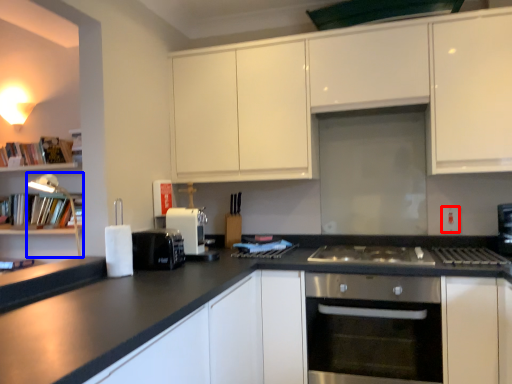
Question: Which object appears farthest to the camera in this image, electric outlet (highlighted by a red box) or lamp (highlighted by a blue box)?

Choices:
 (A) electric outlet
 (B) lamp

Answer: (A)